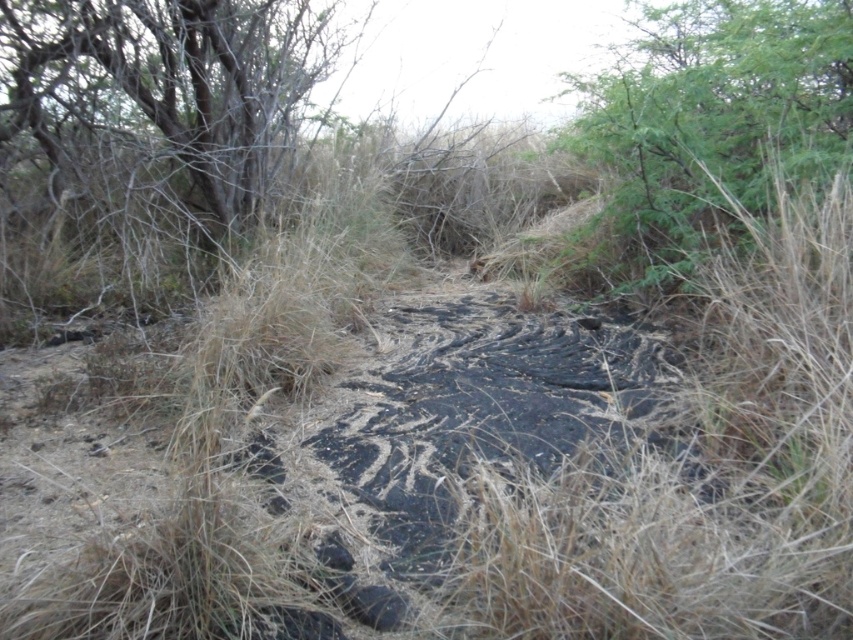
Question: Does green leafy tree at upper right appear over gray bark tree at upper left?

Choices:
 (A) yes
 (B) no

Answer: (A)

Question: Among these points, which one is farthest from the camera?

Choices:
 (A) click(221, 70)
 (B) click(697, 164)

Answer: (A)

Question: Which of the following is the closest to the observer?

Choices:
 (A) (103, 58)
 (B) (641, 275)

Answer: (A)

Question: Is green leafy tree at upper right closer to the viewer compared to gray bark tree at upper left?

Choices:
 (A) no
 (B) yes

Answer: (B)

Question: Among these points, which one is farthest from the camera?

Choices:
 (A) (674, 250)
 (B) (268, 164)

Answer: (B)

Question: Does green leafy tree at upper right appear under gray bark tree at upper left?

Choices:
 (A) no
 (B) yes

Answer: (A)